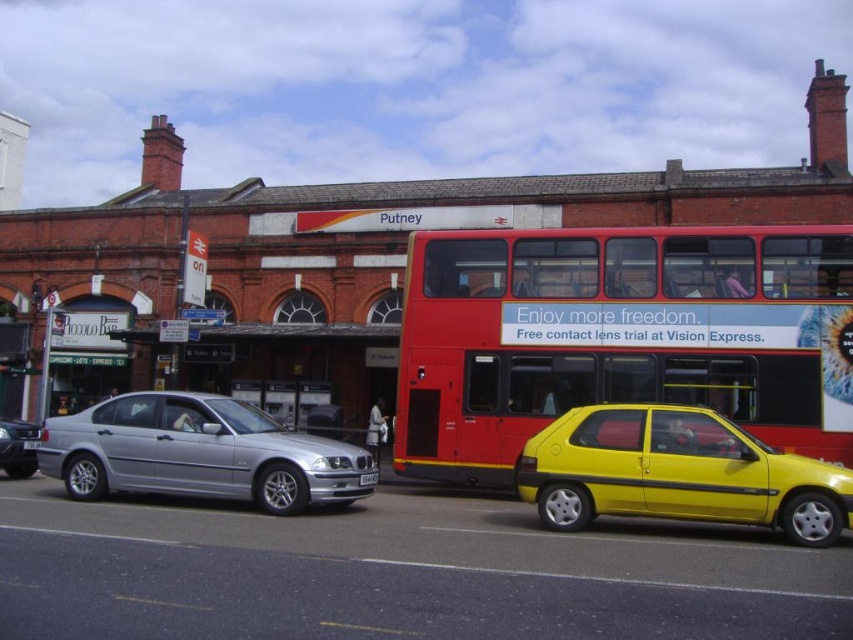
Question: Which point is closer to the camera?

Choices:
 (A) (26, 426)
 (B) (25, 448)
 (C) (86, 451)

Answer: (C)

Question: From the image, what is the correct spatial relationship of shiny yellow car at lower right in relation to satin silver sedan at left?

Choices:
 (A) above
 (B) below

Answer: (B)

Question: Among these points, which one is nearest to the camera?

Choices:
 (A) (175, 484)
 (B) (33, 444)

Answer: (A)

Question: Does silver metallic sedan at center have a smaller size compared to white plastic license plate at center?

Choices:
 (A) no
 (B) yes

Answer: (A)

Question: Considering the relative positions of silver metallic sedan at center and black plastic license plate at center in the image provided, where is silver metallic sedan at center located with respect to black plastic license plate at center?

Choices:
 (A) above
 (B) below

Answer: (B)

Question: Which point is farther to the camera?

Choices:
 (A) shiny yellow car at lower right
 (B) white plastic license plate at center

Answer: (B)